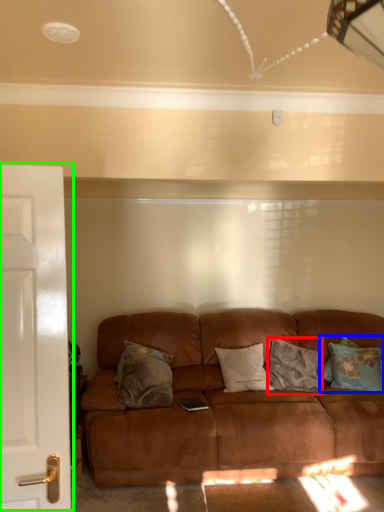
Question: Which is farther away from pillow (highlighted by a red box)? pillow (highlighted by a blue box) or door (highlighted by a green box)?

Choices:
 (A) pillow
 (B) door

Answer: (B)